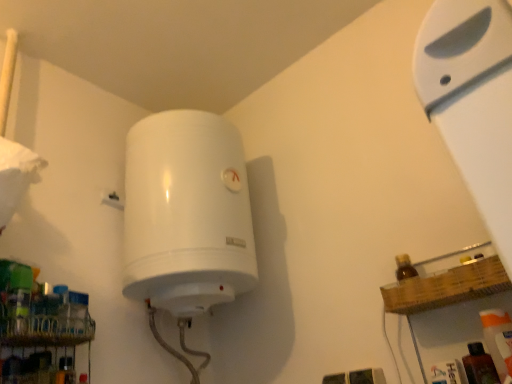
Question: Does metallic wire rack at lower left have a greater height compared to translucent plastic spray bottle at lower right?

Choices:
 (A) yes
 (B) no

Answer: (B)

Question: From the image's perspective, does metallic wire rack at lower left appear lower than translucent plastic spray bottle at lower right?

Choices:
 (A) no
 (B) yes

Answer: (B)

Question: Considering the relative sizes of metallic wire rack at lower left and translucent plastic spray bottle at lower right in the image provided, is metallic wire rack at lower left bigger than translucent plastic spray bottle at lower right?

Choices:
 (A) yes
 (B) no

Answer: (A)

Question: Is metallic wire rack at lower left directly adjacent to translucent plastic spray bottle at lower right?

Choices:
 (A) yes
 (B) no

Answer: (B)

Question: From the image's perspective, is metallic wire rack at lower left located above translucent plastic spray bottle at lower right?

Choices:
 (A) yes
 (B) no

Answer: (B)

Question: Does metallic wire rack at lower left appear on the right side of translucent plastic spray bottle at lower right?

Choices:
 (A) yes
 (B) no

Answer: (B)

Question: Is white plastic shelf at upper right completely or partially inside metallic wire rack at lower left?

Choices:
 (A) no
 (B) yes

Answer: (A)

Question: Is metallic wire rack at lower left thinner than white plastic shelf at upper right?

Choices:
 (A) no
 (B) yes

Answer: (A)

Question: Is metallic wire rack at lower left next to white plastic shelf at upper right and touching it?

Choices:
 (A) no
 (B) yes

Answer: (A)

Question: Is metallic wire rack at lower left oriented away from white plastic shelf at upper right?

Choices:
 (A) yes
 (B) no

Answer: (B)

Question: Considering the relative sizes of metallic wire rack at lower left and white plastic shelf at upper right in the image provided, is metallic wire rack at lower left smaller than white plastic shelf at upper right?

Choices:
 (A) yes
 (B) no

Answer: (A)

Question: Considering the relative positions of metallic wire rack at lower left and white plastic shelf at upper right in the image provided, is metallic wire rack at lower left to the right of white plastic shelf at upper right from the viewer's perspective?

Choices:
 (A) no
 (B) yes

Answer: (A)

Question: Does white plastic shelf at upper right come in front of translucent plastic spray bottle at lower right?

Choices:
 (A) yes
 (B) no

Answer: (A)